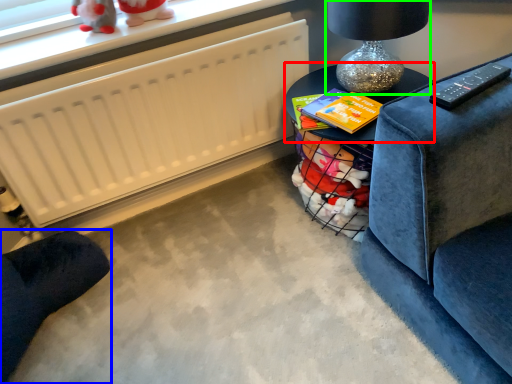
Question: Considering the real-world distances, which object is farthest from table (highlighted by a red box)? furniture (highlighted by a blue box) or table lamp (highlighted by a green box)?

Choices:
 (A) furniture
 (B) table lamp

Answer: (A)